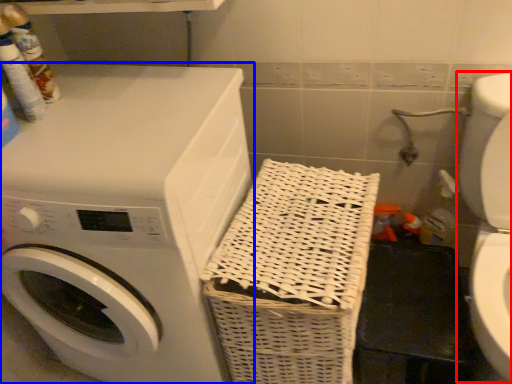
Question: Which point is closer to the camera, washer (highlighted by a red box) or washing machine (highlighted by a blue box)?

Choices:
 (A) washer
 (B) washing machine

Answer: (A)